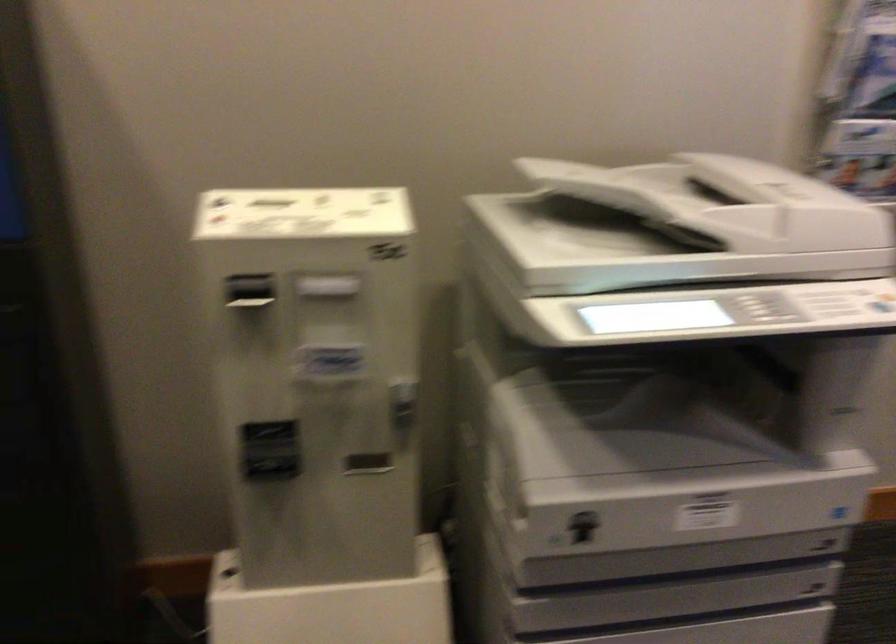
The width and height of the screenshot is (896, 644). Describe the element at coordinates (724, 203) in the screenshot. I see `the printer feeder lid` at that location.